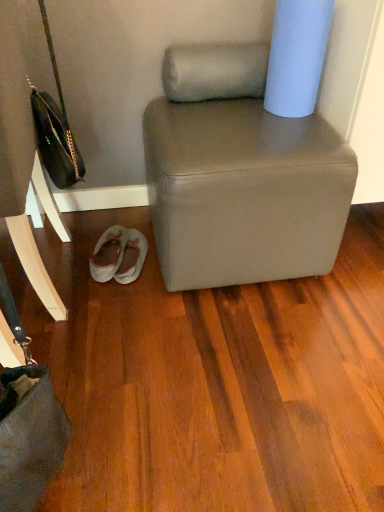
This screenshot has width=384, height=512. What are the coordinates of `free point behind light gray suede slippers at lower left` in the screenshot? It's located at [x=114, y=220].